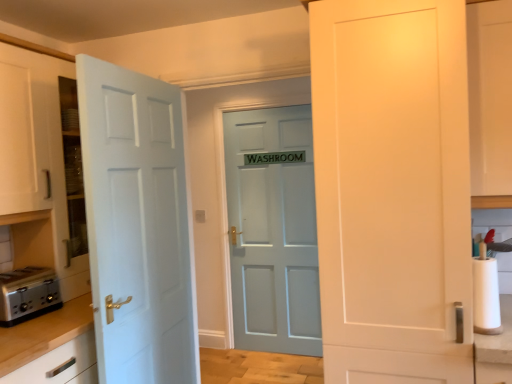
Question: Does white matte door at right, acting as the 3th door starting from the back, have a smaller size compared to white paper at right?

Choices:
 (A) no
 (B) yes

Answer: (A)

Question: From the image's perspective, is white matte door at right, the 1th door when ordered from front to back, above white paper at right?

Choices:
 (A) no
 (B) yes

Answer: (B)

Question: Is white matte door at right, acting as the 3th door starting from the back, aimed at white paper at right?

Choices:
 (A) yes
 (B) no

Answer: (B)

Question: Is white matte door at right, acting as the 3th door starting from the back, looking in the opposite direction of white paper at right?

Choices:
 (A) yes
 (B) no

Answer: (B)

Question: Is white matte door at right, acting as the 3th door starting from the back, to the left of white paper at right from the viewer's perspective?

Choices:
 (A) no
 (B) yes

Answer: (B)

Question: Relative to light blue painted door at left, positioned as the second door in back-to-front order, is white matte door at right, the 1th door when ordered from front to back, in front or behind?

Choices:
 (A) front
 (B) behind

Answer: (A)

Question: Considering the positions of white matte door at right, acting as the 3th door starting from the back, and light blue painted door at left, the second door positioned from the front, in the image, is white matte door at right, acting as the 3th door starting from the back, bigger or smaller than light blue painted door at left, the second door positioned from the front,?

Choices:
 (A) big
 (B) small

Answer: (A)

Question: Is white matte door at right, acting as the 3th door starting from the back, spatially inside light blue painted door at left, positioned as the second door in back-to-front order, or outside of it?

Choices:
 (A) inside
 (B) outside

Answer: (B)

Question: From a real-world perspective, relative to light blue painted door at left, positioned as the second door in back-to-front order, is white matte door at right, the 1th door when ordered from front to back, vertically above or below?

Choices:
 (A) above
 (B) below

Answer: (A)

Question: Considering the positions of point (99, 69) and point (314, 352), is point (99, 69) closer or farther from the camera than point (314, 352)?

Choices:
 (A) closer
 (B) farther

Answer: (A)

Question: Considering the relative positions of light blue painted door at left, positioned as the second door in back-to-front order, and matte blue door at center, marked as the third door in a front-to-back arrangement, in the image provided, is light blue painted door at left, positioned as the second door in back-to-front order, to the left or to the right of matte blue door at center, marked as the third door in a front-to-back arrangement,?

Choices:
 (A) right
 (B) left

Answer: (B)

Question: Considering the positions of light blue painted door at left, positioned as the second door in back-to-front order, and matte blue door at center, marked as the first door in a back-to-front arrangement, in the image, is light blue painted door at left, positioned as the second door in back-to-front order, bigger or smaller than matte blue door at center, marked as the first door in a back-to-front arrangement,?

Choices:
 (A) big
 (B) small

Answer: (B)

Question: From a real-world perspective, is light blue painted door at left, positioned as the second door in back-to-front order, above or below matte blue door at center, marked as the first door in a back-to-front arrangement?

Choices:
 (A) below
 (B) above

Answer: (B)

Question: Is matte blue door at center, marked as the third door in a front-to-back arrangement, taller or shorter than light blue painted door at left, positioned as the second door in back-to-front order?

Choices:
 (A) short
 (B) tall

Answer: (B)

Question: From a real-world perspective, relative to light blue painted door at left, positioned as the second door in back-to-front order, is matte blue door at center, marked as the third door in a front-to-back arrangement, vertically above or below?

Choices:
 (A) below
 (B) above

Answer: (A)